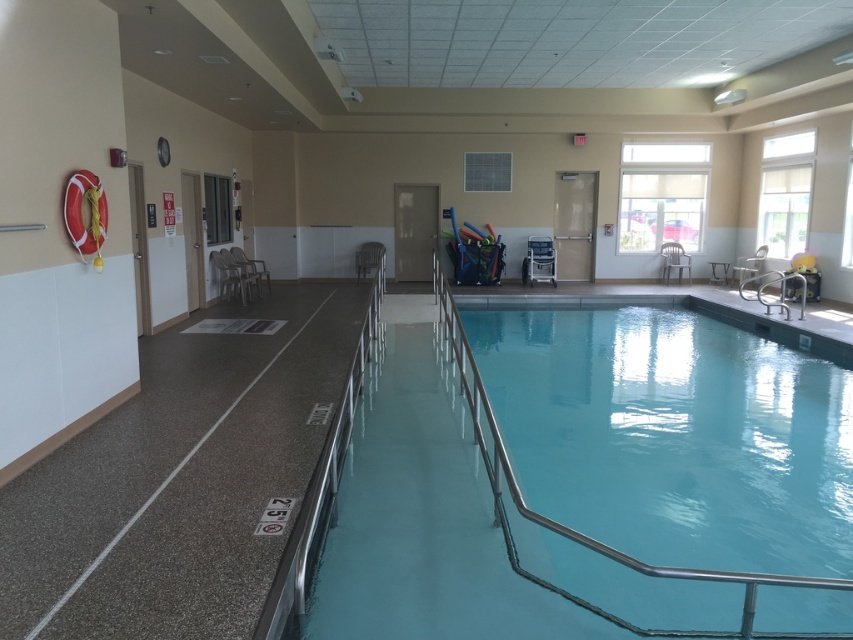
Question: Can you confirm if smooth blue water at center is thinner than metallic silver chair at center?

Choices:
 (A) yes
 (B) no

Answer: (B)

Question: Which of these objects is positioned farthest from the metallic silver chair at center?

Choices:
 (A) plastic/glossy chair at upper left
 (B) blue plastic chair at center
 (C) smooth blue water at center

Answer: (C)

Question: Does blue plastic chair at center appear under plastic/glossy chair at upper left?

Choices:
 (A) yes
 (B) no

Answer: (B)

Question: Which of these objects is positioned closest to the white plastic chair at center?

Choices:
 (A) blue plastic chair at center
 (B) metallic silver chair at center
 (C) metallic silver chair at right

Answer: (C)

Question: Based on their relative distances, which object is farther from the smooth blue water at center?

Choices:
 (A) blue plastic chair at center
 (B) plastic/glossy chair at upper left
 (C) silver metallic rail at right

Answer: (B)

Question: Is metallic silver chair at right further to camera compared to plastic/glossy chair at upper left?

Choices:
 (A) no
 (B) yes

Answer: (B)